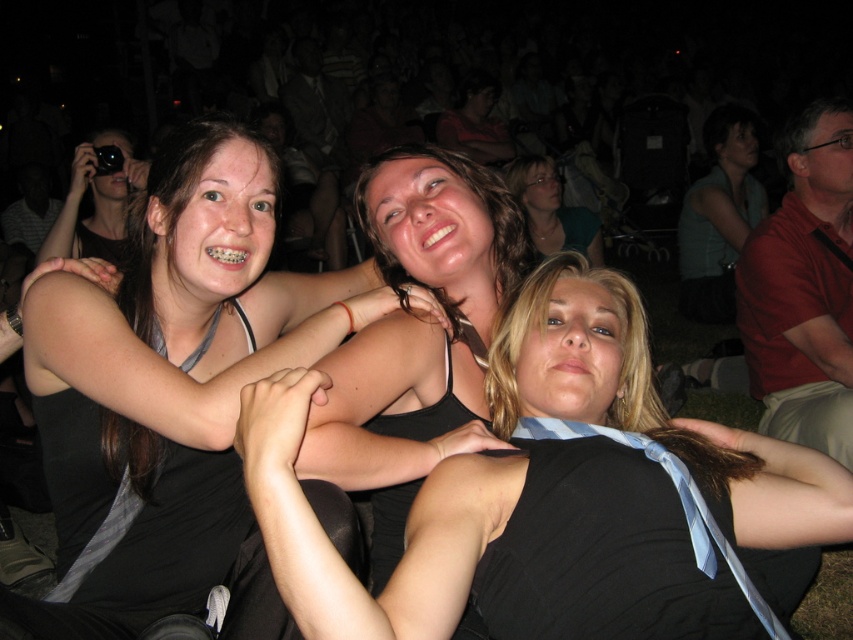
Question: Is black fabric at center above matte black tank top at center?

Choices:
 (A) yes
 (B) no

Answer: (B)

Question: Which point is farther from the camera taking this photo?

Choices:
 (A) (543, 216)
 (B) (531, 330)
 (C) (222, 483)
 (D) (207, 436)

Answer: (A)

Question: Which point is closer to the camera?

Choices:
 (A) matte black tank top at center
 (B) black matte dress at left
 (C) black matte dress at center

Answer: (B)

Question: Does black matte tank top at upper center appear under black matte dress at left?

Choices:
 (A) yes
 (B) no

Answer: (B)

Question: Which point is closer to the camera taking this photo?

Choices:
 (A) (554, 184)
 (B) (102, 314)

Answer: (B)

Question: Is black matte dress at left closer to the viewer compared to matte black tank top at center?

Choices:
 (A) yes
 (B) no

Answer: (A)